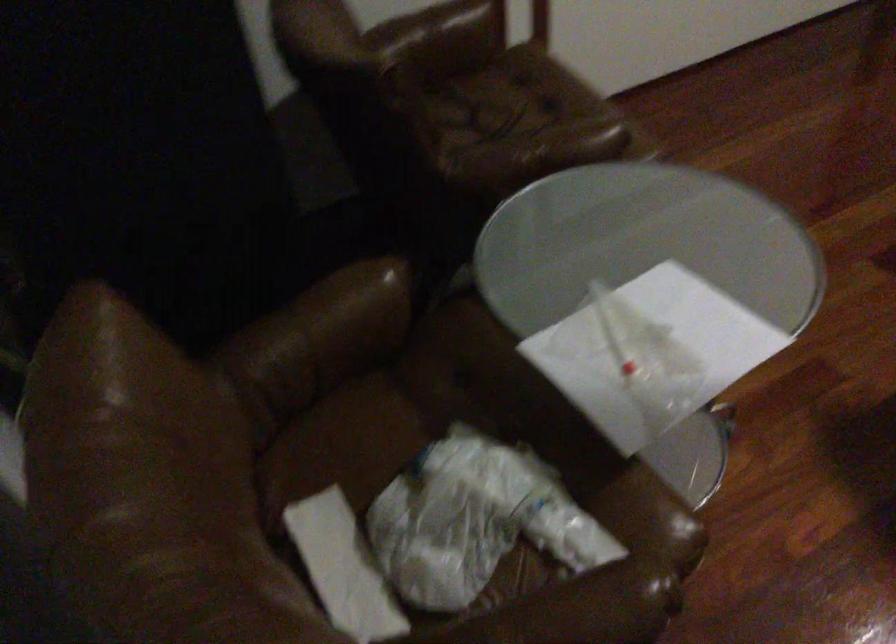
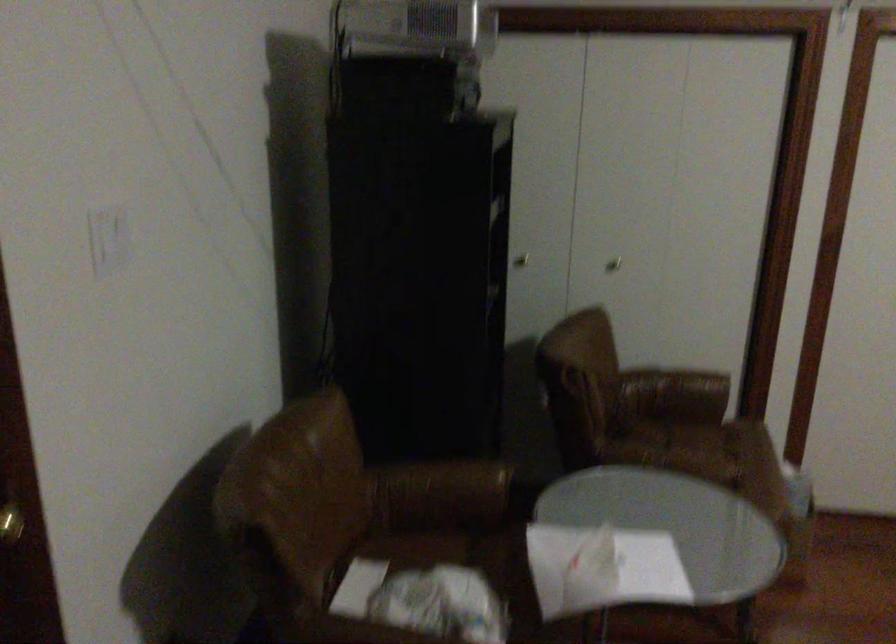
Locate, in the second image, the point that corresponds to point (323, 337) in the first image.

(442, 488)